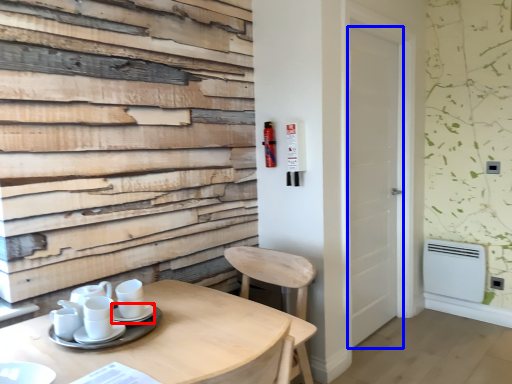
Question: Which of the following is the farthest to the observer, saucer (highlighted by a red box) or door (highlighted by a blue box)?

Choices:
 (A) saucer
 (B) door

Answer: (B)